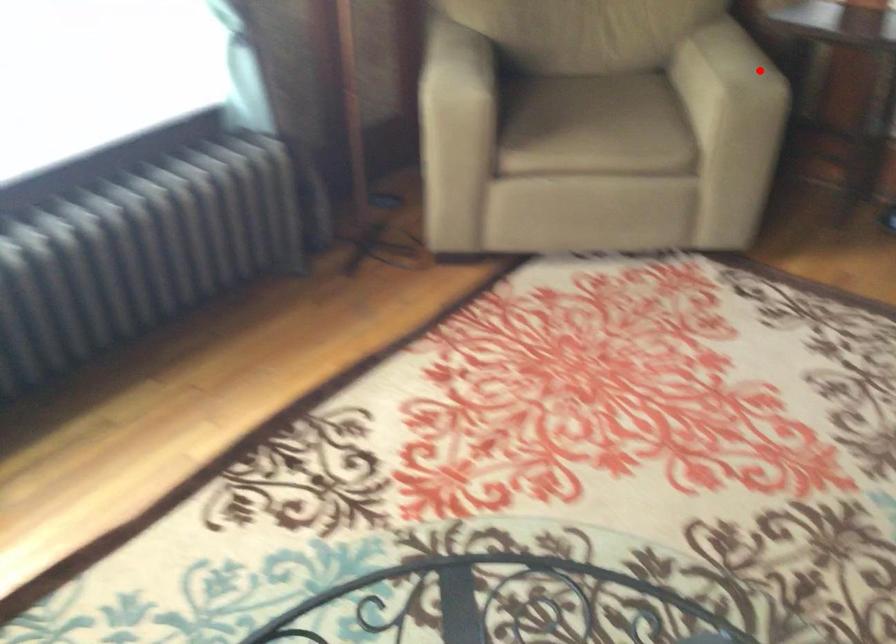
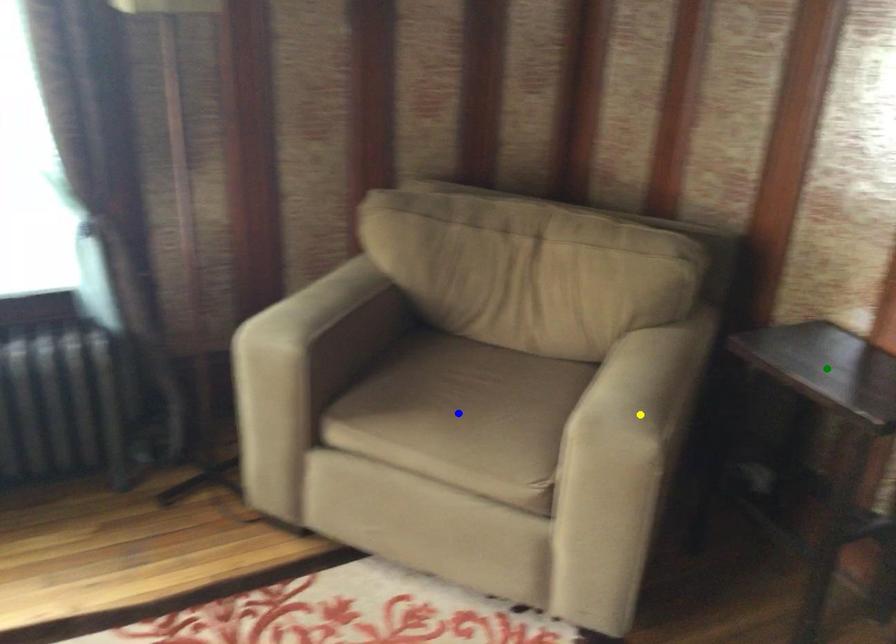
Question: I am providing you with two images of the same scene from different viewpoints. A red point is marked on the first image. You are given multiple points on the second image. Which point in image 2 represents the same 3d spot as the red point in image 1?

Choices:
 (A) green point
 (B) yellow point
 (C) blue point

Answer: (B)